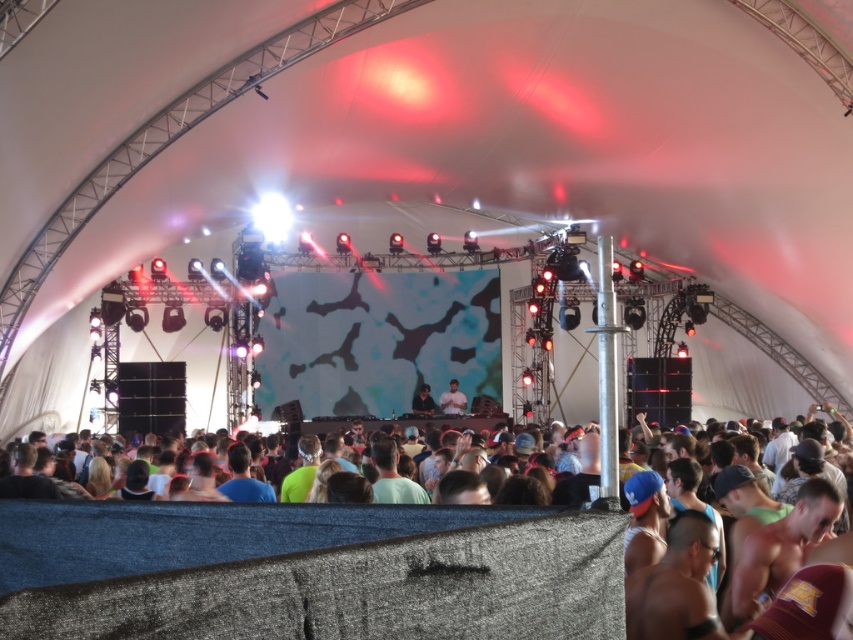
You are a stagehand preparing to hang a banner that requires at least 2 meters of clearance above the stage. Given the light beige fabric at center and the matte black dj booth at center, which object is positioned higher and would allow you to safely hang the banner?

The light beige fabric at center has a greater height compared to the matte black dj booth at center, so the banner can be safely hung above the light beige fabric at center as it provides the necessary clearance.

You are a stagehand setting up a new microphone stand. You need to place it in the center of the tent. The light beige fabric at center and the matte black dj booth at center are both in the way. Which object should you move to make space?

The light beige fabric at center should be moved because its width is larger than the matte black dj booth at center, making it the wider obstruction in the center of the tent.